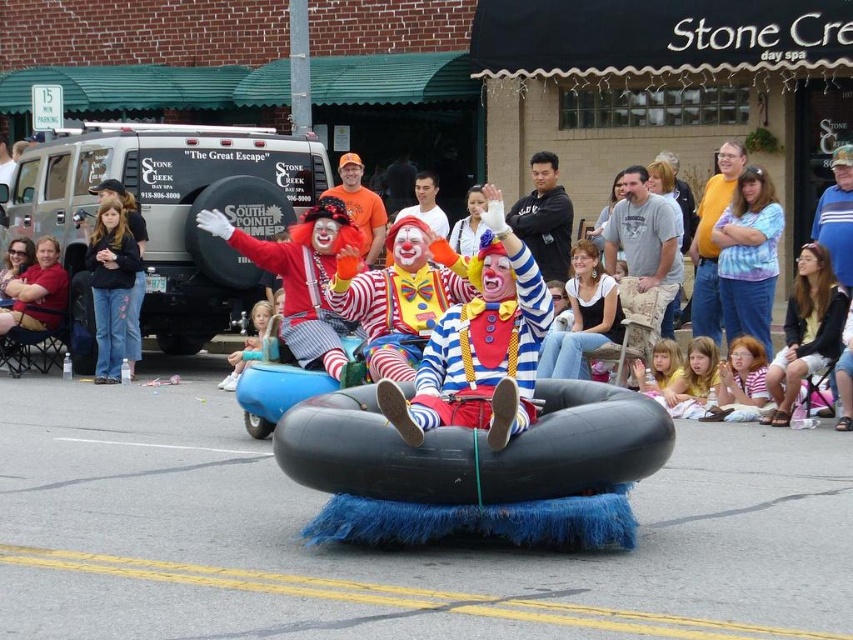
Is matte clown costume at center to the left of black cotton shirt at center from the viewer's perspective?

Correct, you'll find matte clown costume at center to the left of black cotton shirt at center.

Is point (492, 362) positioned before point (535, 252)?

Yes, it is.

At what (x,y) coordinates should I click in order to perform the action: click on matte clown costume at center. Please return your answer as a coordinate pair (x, y). This screenshot has height=640, width=853. Looking at the image, I should click on (480, 346).

I want to click on matte clown costume at center, so click(480, 346).

Does black cotton shirt at center have a lesser width compared to orange cotton t-shirt at center?

Incorrect, black cotton shirt at center's width is not less than orange cotton t-shirt at center's.

Who is positioned more to the right, black cotton shirt at center or orange cotton t-shirt at center?

black cotton shirt at center

Image resolution: width=853 pixels, height=640 pixels. I want to click on black cotton shirt at center, so (544, 218).

Can you confirm if matte clown costume at center is positioned above orange cotton t-shirt at center?

Actually, matte clown costume at center is below orange cotton t-shirt at center.

Is point (489, 348) in front of point (367, 228)?

Yes, point (489, 348) is in front of point (367, 228).

Is point (440, 349) closer to camera compared to point (369, 202)?

Yes.

Find the location of a particular element. This screenshot has width=853, height=640. matte clown costume at center is located at coordinates (480, 346).